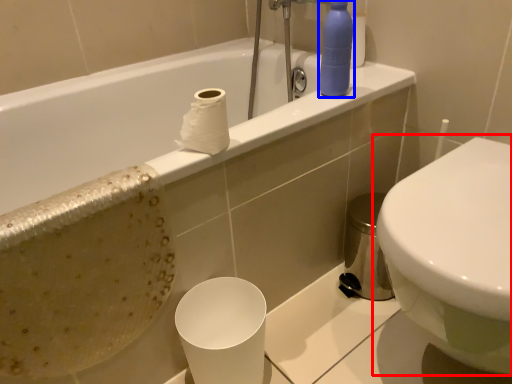
Question: Among these objects, which one is farthest to the camera, toilet (highlighted by a red box) or cleaning product (highlighted by a blue box)?

Choices:
 (A) toilet
 (B) cleaning product

Answer: (B)